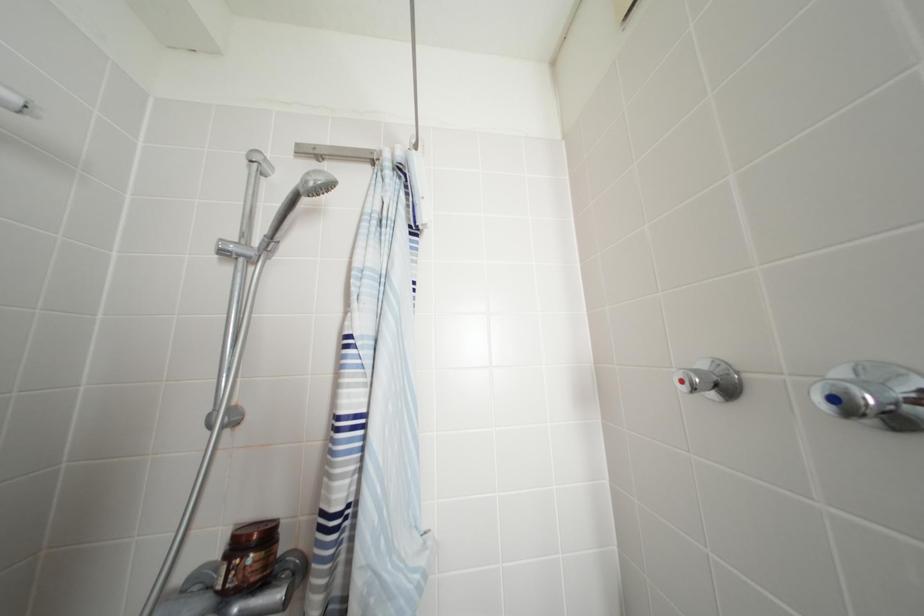
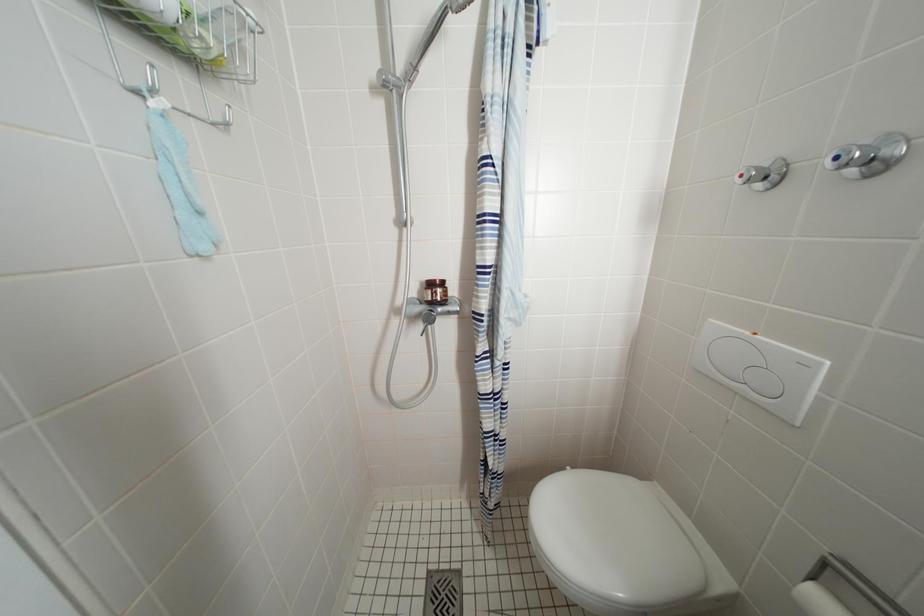
Question: How did the camera likely rotate?

Choices:
 (A) Left
 (B) Right
 (C) Up
 (D) Down

Answer: (D)